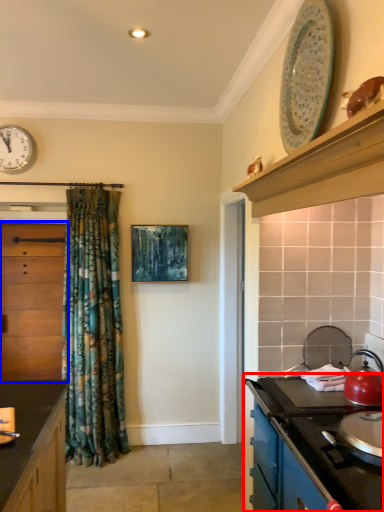
Question: Which object appears farthest to the camera in this image, cabinetry (highlighted by a red box) or cabinetry (highlighted by a blue box)?

Choices:
 (A) cabinetry
 (B) cabinetry

Answer: (B)